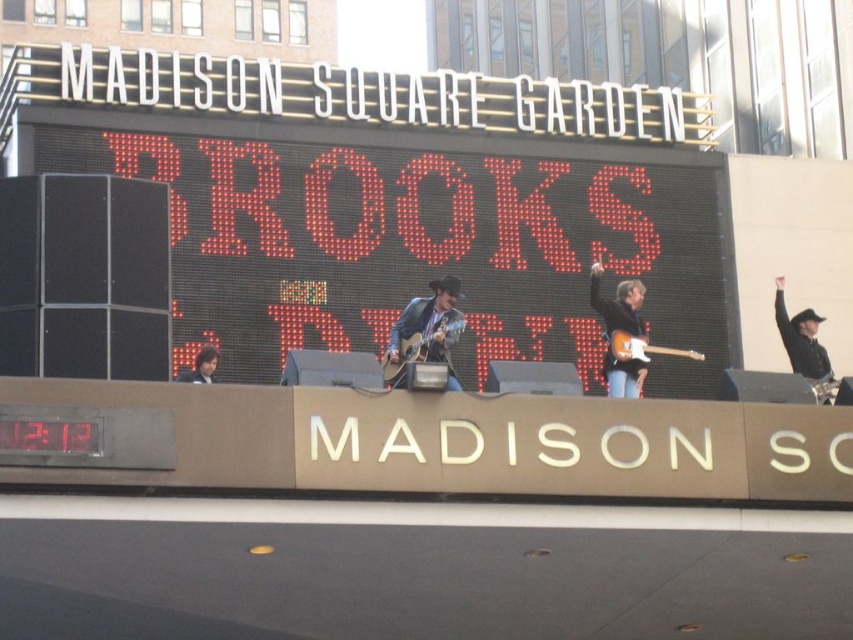
You are a photographer positioned at the front row of the Madison Square Garden concert. You want to capture a photo of both the matte brown acoustic guitar at center and the wooden electric guitar at center. Which guitar should you pan your camera to the left to include in the frame first?

The matte brown acoustic guitar at center is to the left of the wooden electric guitar at center, so you should pan your camera to the left first to include the matte brown acoustic guitar at center before capturing the wooden electric guitar at center.

You are a stagehand who needs to place a new microphone stand between the black leather hat at upper right and the matte brown acoustic guitar at center. Considering their widths, which object should you position closer to the center of the stage to ensure the stand fits properly?

The black leather hat at upper right has a smaller width than the matte brown acoustic guitar at center. To ensure the microphone stand fits between them, position the black leather hat at upper right closer to the center of the stage since it takes up less space.